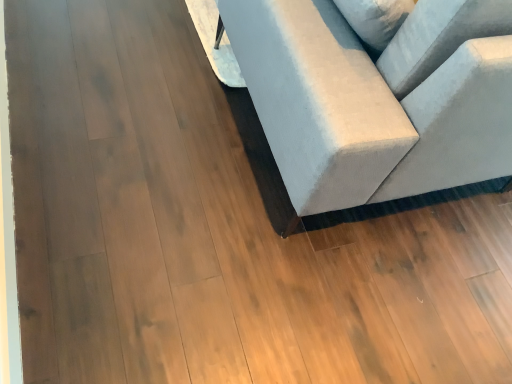
Locate an element on the screen. suede-like gray couch at lower right is located at coordinates (384, 104).

Describe the element at coordinates (384, 104) in the screenshot. I see `suede-like gray couch at lower right` at that location.

Measure the distance between suede-like gray couch at lower right and camera.

30.88 inches.

In order to face suede-like gray couch at lower right, should I rotate leftwards or rightwards?

Rotate your view right by about 17.868°.

Where is `suede-like gray couch at lower right`? The image size is (512, 384). suede-like gray couch at lower right is located at coordinates (384, 104).